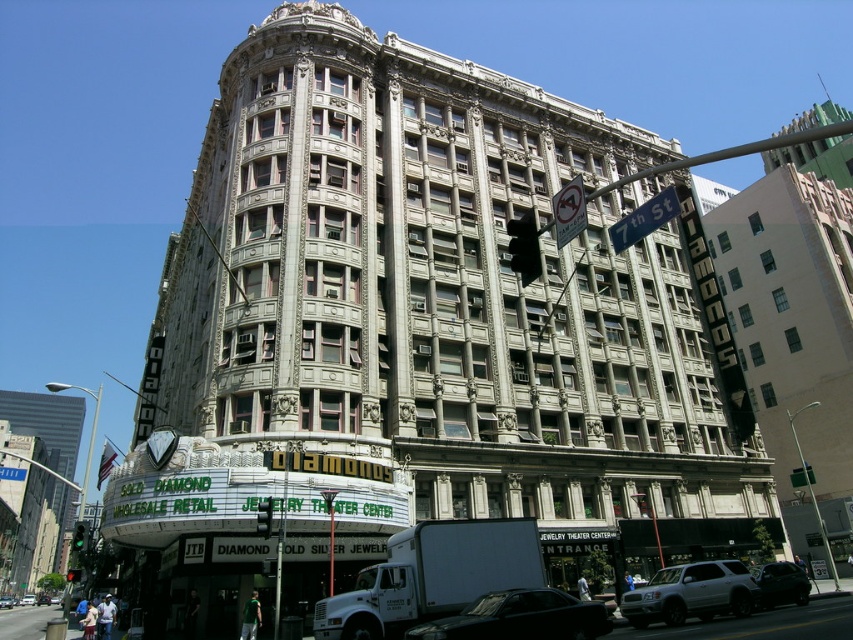
You are a delivery driver approaching the intersection where the grand building with the Gold Diamond marquee is located. You notice two traffic lights at the intersection. According to the scene, which traffic light is narrower between the green glass traffic light at upper center and the red glass traffic light at upper center?

The green glass traffic light at upper center is thinner than the red glass traffic light at upper center, so the green one is narrower.

You are a pedestrian standing at the crosswalk near the Gold Diamond jewelry store. You need to cross the street to reach the entrance of the building. However, there is a shiny black car at lower right and a red glass traffic light at upper center in your view. Based on their positions, can you safely cross the street right now?

The shiny black car at lower right is positioned over the red glass traffic light at upper center, which means the traffic light is red, indicating that it is safe to cross the street now.